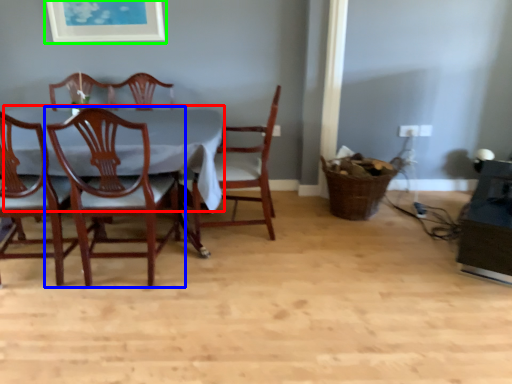
Question: Which object is positioned closest to table top (highlighted by a red box)? Select from chair (highlighted by a blue box) and picture frame (highlighted by a green box).

Choices:
 (A) chair
 (B) picture frame

Answer: (A)